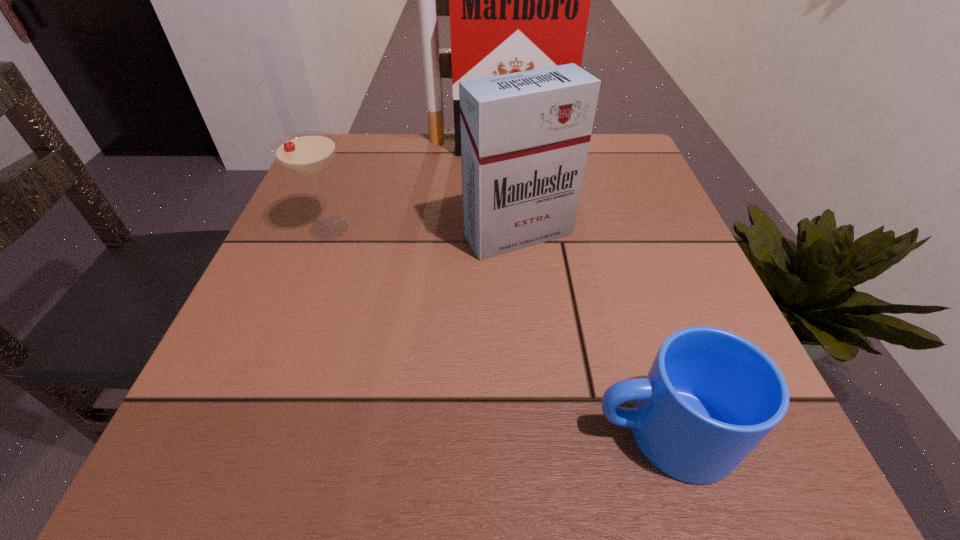
The image size is (960, 540). Identify the location of free spot between the farther cigarette case and the second shortest object. (413, 187).

Locate an element on the screen. This screenshot has height=540, width=960. free area in between the mug and the tallest object is located at coordinates (580, 289).

Identify the location of free point between the farthest object and the shortest object. (580, 289).

Identify which object is located as the nearest to the shorter cigarette case. Please provide its 2D coordinates. Your answer should be formatted as a tuple, i.e. [(x, y)], where the tuple contains the x and y coordinates of a point satisfying the conditions above.

[(308, 153)]

Locate an element on the screen. Image resolution: width=960 pixels, height=540 pixels. the closest object to the mug is located at coordinates (525, 136).

Where is `vacant area in the image that satisfies the following two spatial constraints: 1. on the front-facing side of the tallest object; 2. on the left side of the second tallest object`? vacant area in the image that satisfies the following two spatial constraints: 1. on the front-facing side of the tallest object; 2. on the left side of the second tallest object is located at coordinates (501, 235).

In order to click on vacant position in the image that satisfies the following two spatial constraints: 1. on the front-facing side of the farther cigarette case; 2. on the left side of the shorter cigarette case in this screenshot , I will do `click(501, 235)`.